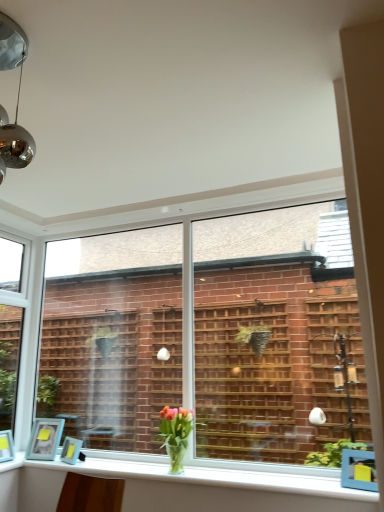
Locate an element on the screen. vacant area on top of clear glass window at left, which appears as the 2th window when viewed from the right (from a real-world perspective) is located at coordinates (15, 221).